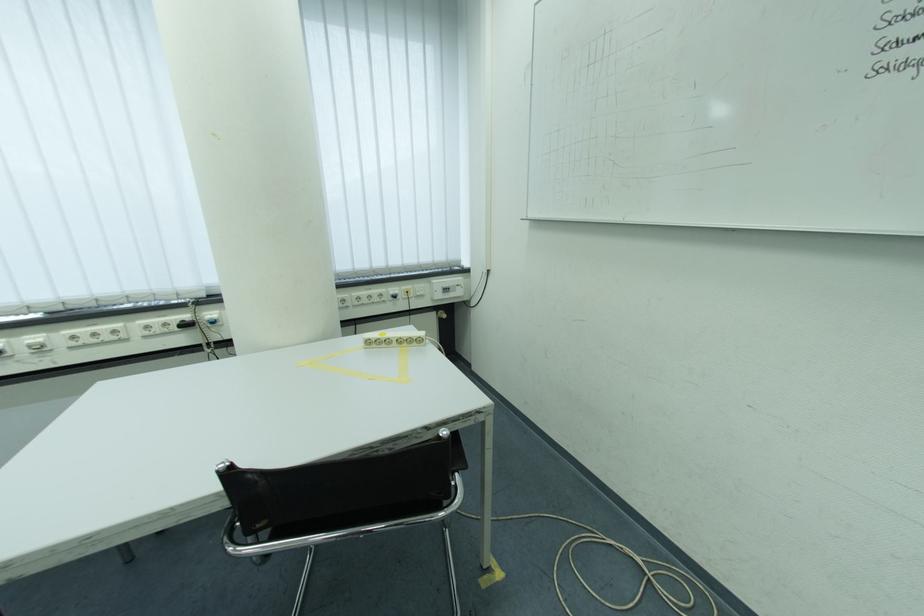
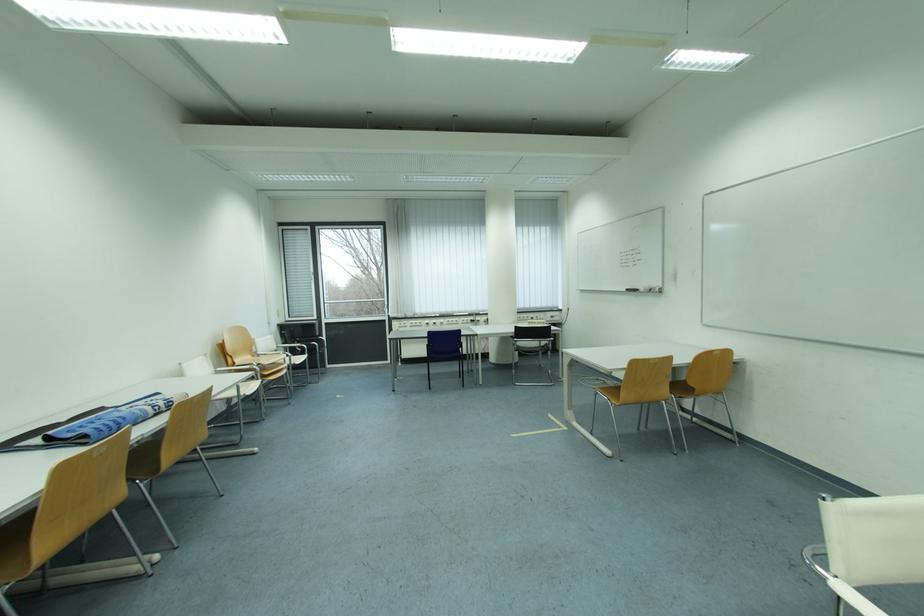
Question: What movement of the cameraman would produce the second image?

Choices:
 (A) Left
 (B) Right
 (C) Forward
 (D) Backward

Answer: (D)